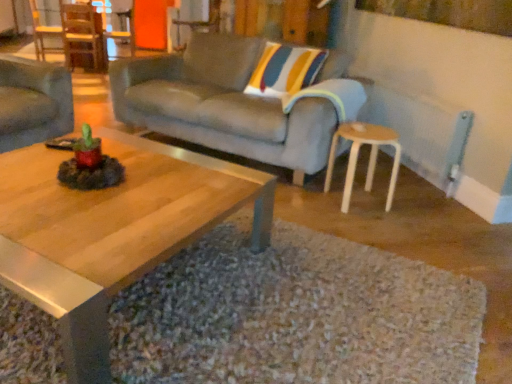
Question: Is wooden chair at left, the second chair viewed from the front, to the left of matte gray couch at left, which is the 1th studio couch in left-to-right order, from the viewer's perspective?

Choices:
 (A) no
 (B) yes

Answer: (B)

Question: Could you tell me if wooden chair at left, which is the first chair from back to front, is facing matte gray couch at left, which is the 1th studio couch in left-to-right order?

Choices:
 (A) no
 (B) yes

Answer: (A)

Question: Would you say wooden chair at left, the second chair viewed from the front, contains matte gray couch at left, positioned as the second studio couch in right-to-left order?

Choices:
 (A) yes
 (B) no

Answer: (B)

Question: Can you confirm if wooden chair at left, which is the first chair from back to front, is bigger than matte gray couch at left, which is the 1th studio couch in left-to-right order?

Choices:
 (A) yes
 (B) no

Answer: (B)

Question: Considering the relative sizes of wooden chair at left, which is the first chair in left-to-right order, and matte gray couch at left, positioned as the second studio couch in right-to-left order, in the image provided, is wooden chair at left, which is the first chair in left-to-right order, smaller than matte gray couch at left, positioned as the second studio couch in right-to-left order,?

Choices:
 (A) no
 (B) yes

Answer: (B)

Question: From their relative heights in the image, would you say wooden polished coffee table at center is taller or shorter than matte gray couch at left, which is the 1th studio couch in left-to-right order?

Choices:
 (A) short
 (B) tall

Answer: (A)

Question: Relative to matte gray couch at left, positioned as the second studio couch in right-to-left order, is wooden polished coffee table at center in front or behind?

Choices:
 (A) front
 (B) behind

Answer: (A)

Question: Is point (10, 243) closer or farther from the camera than point (39, 107)?

Choices:
 (A) closer
 (B) farther

Answer: (A)

Question: From a real-world perspective, is wooden polished coffee table at center above or below matte gray couch at left, positioned as the second studio couch in right-to-left order?

Choices:
 (A) below
 (B) above

Answer: (A)

Question: From a real-world perspective, relative to wooden polished coffee table at center, is white plastic stool at lower right vertically above or below?

Choices:
 (A) above
 (B) below

Answer: (A)

Question: Choose the correct answer: Is white plastic stool at lower right inside wooden polished coffee table at center or outside it?

Choices:
 (A) inside
 (B) outside

Answer: (B)

Question: In terms of height, does white plastic stool at lower right look taller or shorter compared to wooden polished coffee table at center?

Choices:
 (A) short
 (B) tall

Answer: (B)

Question: In terms of size, does white plastic stool at lower right appear bigger or smaller than wooden polished coffee table at center?

Choices:
 (A) small
 (B) big

Answer: (A)

Question: Relative to wooden chair at left, which is the first chair from back to front, is white plastic stool at lower right in front or behind?

Choices:
 (A) front
 (B) behind

Answer: (A)

Question: In the image, is white plastic stool at lower right on the left side or the right side of wooden chair at left, placed as the 2th chair when sorted from right to left?

Choices:
 (A) right
 (B) left

Answer: (A)